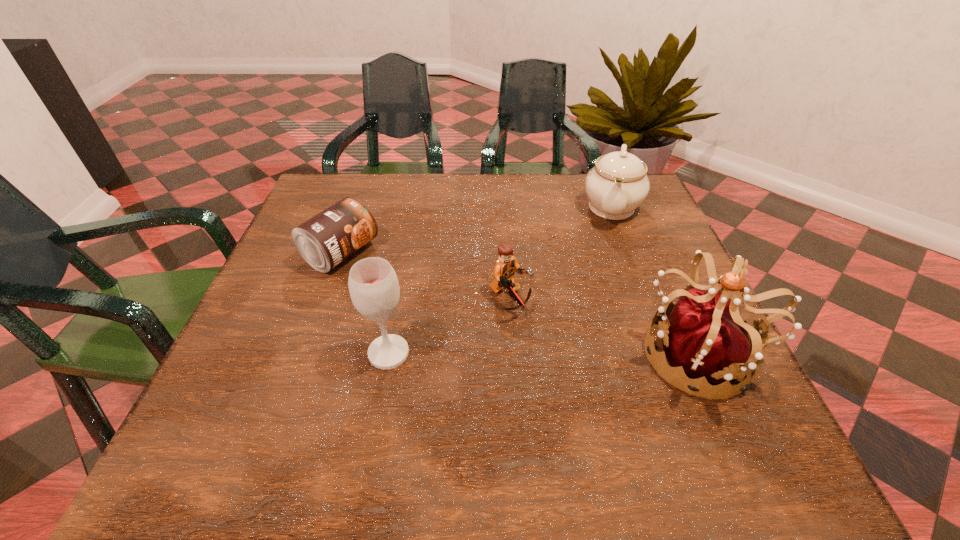
Locate an element on the screen. free space on the desktop that is between the fourth object from right to left and the tiara and is positioned on the front label of the leftmost object is located at coordinates click(x=537, y=353).

The image size is (960, 540). In order to click on free space on the desktop that is between the wineglass and the tiara and is positioned holding a crossbow in the hands of the Lego in this screenshot , I will do `click(590, 354)`.

The height and width of the screenshot is (540, 960). I want to click on vacant space on the desktop that is between the wineglass and the tiara and is positioned at the spout of the chinaware, so click(586, 354).